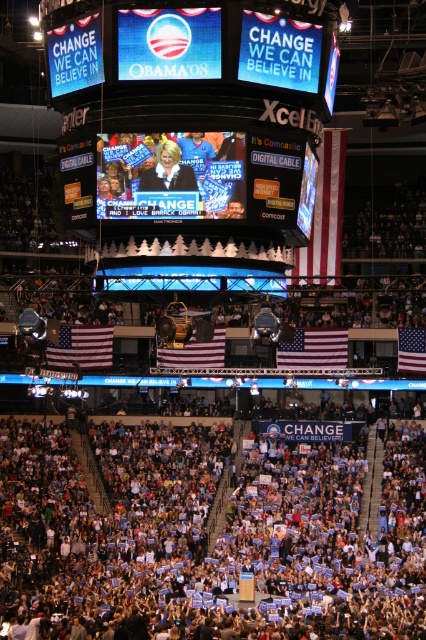
Question: Does american flag at lower left appear over american flag at center?

Choices:
 (A) no
 (B) yes

Answer: (A)

Question: Can you confirm if matte digital cable sign at center is positioned to the left of american flag at center?

Choices:
 (A) yes
 (B) no

Answer: (A)

Question: Is matte digital cable sign at center bigger than american flag at lower left?

Choices:
 (A) yes
 (B) no

Answer: (A)

Question: Which object is farther from the camera taking this photo?

Choices:
 (A) red fabric flag at right
 (B) blue fabric crowd at lower center

Answer: (A)

Question: Which of the following is the farthest from the observer?

Choices:
 (A) blue fabric crowd at lower center
 (B) red fabric flag at right
 (C) matte digital cable sign at center
 (D) white cotton flag at center

Answer: (B)

Question: Estimate the real-world distances between objects in this image. Which object is farther from the american flag at center?

Choices:
 (A) matte digital cable sign at center
 (B) american flag at lower left

Answer: (A)